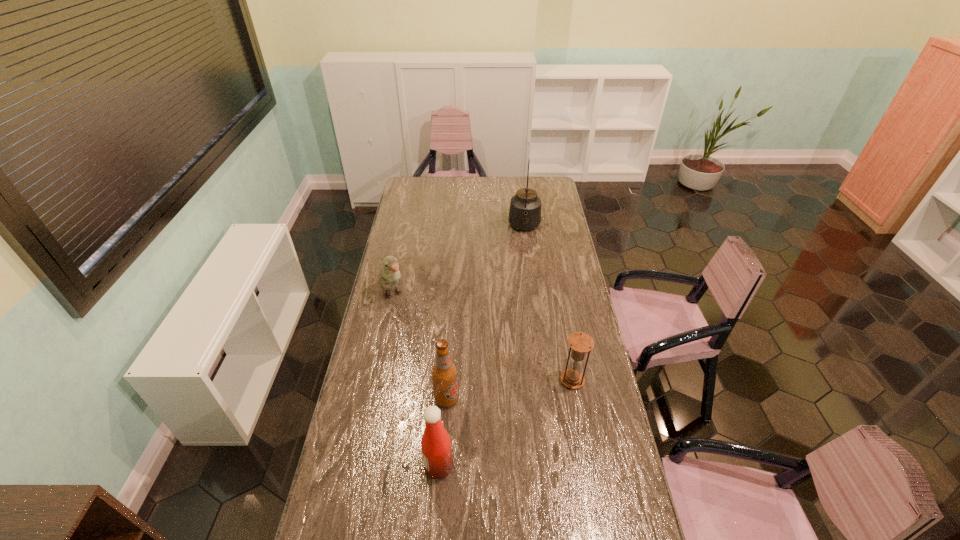
Locate an element on the screen. object located in the left edge section of the desktop is located at coordinates (389, 275).

This screenshot has height=540, width=960. I want to click on hourglass present at the right edge, so click(580, 343).

Locate an element on the screen. kettle situated at the right edge is located at coordinates (x=525, y=207).

What are the coordinates of `vacant space at the far edge` in the screenshot? It's located at (500, 178).

This screenshot has height=540, width=960. What are the coordinates of `vacant space at the near edge of the desktop` in the screenshot? It's located at (550, 523).

Find the location of a particular element. The width and height of the screenshot is (960, 540). vacant space at the left edge of the desktop is located at coordinates (410, 245).

The width and height of the screenshot is (960, 540). What are the coordinates of `free space at the right edge` in the screenshot? It's located at click(x=580, y=409).

Where is `vacant point at the near left corner`? vacant point at the near left corner is located at coordinates (347, 519).

Find the location of `free area in between the hourglass and the nearest object`. free area in between the hourglass and the nearest object is located at coordinates (506, 423).

At what (x,y) coordinates should I click in order to perform the action: click on vacant area between the beer bottle and the leftmost object. Please return your answer as a coordinate pair (x, y). Looking at the image, I should click on 420,347.